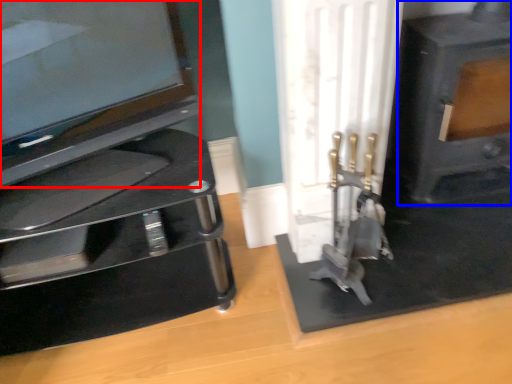
Question: Which of the following is the farthest to the observer, television (highlighted by a red box) or fireplace (highlighted by a blue box)?

Choices:
 (A) television
 (B) fireplace

Answer: (B)